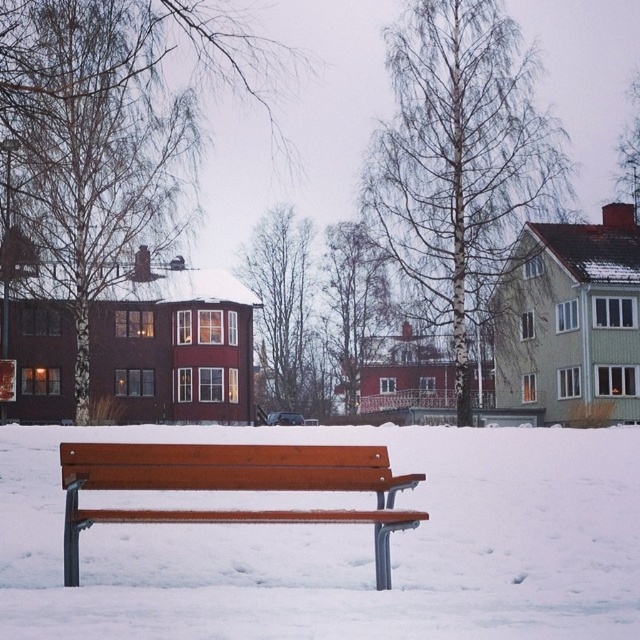
Question: Is the position of white matte bench at center less distant than that of wooden bench at center?

Choices:
 (A) yes
 (B) no

Answer: (A)

Question: Which point is closer to the camera?

Choices:
 (A) (605, 582)
 (B) (248, 474)

Answer: (B)

Question: Where is white matte bench at center located in relation to wooden bench at center in the image?

Choices:
 (A) left
 (B) right

Answer: (B)

Question: Where is white matte bench at center located in relation to wooden bench at center in the image?

Choices:
 (A) above
 (B) below

Answer: (B)